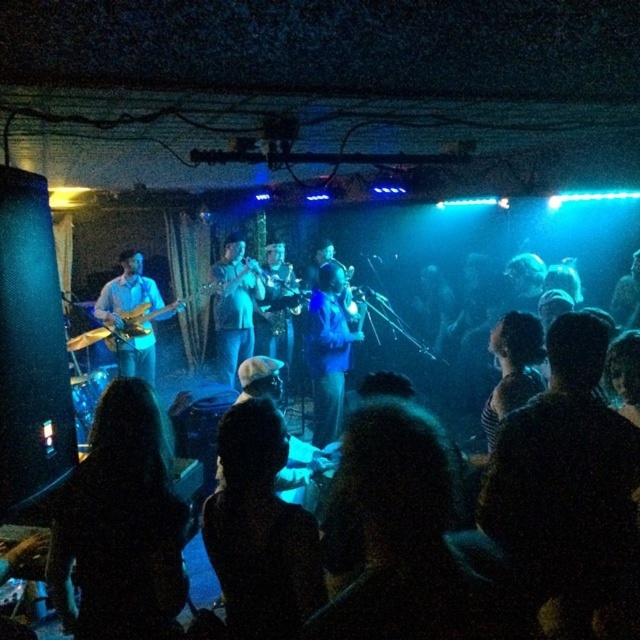
Between point (232, 492) and point (152, 342), which one is positioned behind?

The point (152, 342) is more distant.

Between black matte head at center and matte wood guitar at left, which one is positioned lower?

black matte head at center is below.

Is point (308, 579) positioned after point (138, 369)?

No, it is not.

Locate an element on the screen. The width and height of the screenshot is (640, 640). black matte head at center is located at coordinates (259, 531).

Does matte blue shirt at center lie in front of matte wood guitar at left?

No, it is behind matte wood guitar at left.

Who is more forward, (x=244, y=358) or (x=152, y=372)?

Point (x=152, y=372)

Where is `matte blue shirt at center`? matte blue shirt at center is located at coordinates (234, 307).

Does black hair at lower left appear over matte blue shirt at center?

Incorrect, black hair at lower left is not positioned above matte blue shirt at center.

Which is above, black hair at lower left or matte blue shirt at center?

matte blue shirt at center is above.

Is point (68, 582) closer to camera compared to point (227, 241)?

Yes, it is in front of point (227, 241).

What are the coordinates of `black hair at lower left` in the screenshot? It's located at (120, 525).